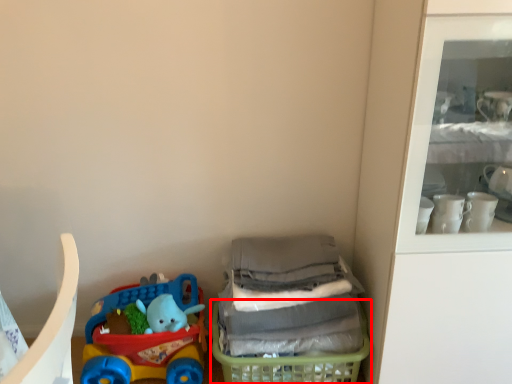
Question: From the image's perspective, where is basket (annotated by the red box) located in relation to toy in the image?

Choices:
 (A) above
 (B) below

Answer: (B)